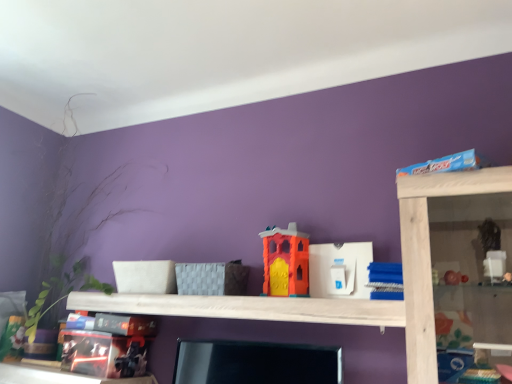
Question: Is white wood shelf at center taller than matt black toy at lower left, the fourth toy in the right-to-left sequence?

Choices:
 (A) no
 (B) yes

Answer: (A)

Question: Is white wood shelf at center in contact with matt black toy at lower left, the fourth toy in the right-to-left sequence?

Choices:
 (A) yes
 (B) no

Answer: (B)

Question: From the image's perspective, is white wood shelf at center on matt black toy at lower left, which is counted as the first toy, starting from the left?

Choices:
 (A) yes
 (B) no

Answer: (A)

Question: Is white wood shelf at center facing towards matt black toy at lower left, the fourth toy in the right-to-left sequence?

Choices:
 (A) yes
 (B) no

Answer: (B)

Question: Does white wood shelf at center have a lesser width compared to matt black toy at lower left, the fourth toy in the right-to-left sequence?

Choices:
 (A) no
 (B) yes

Answer: (B)

Question: Is point (217, 304) closer or farther from the camera than point (366, 269)?

Choices:
 (A) farther
 (B) closer

Answer: (A)

Question: Considering the positions of white wood shelf at center and white plastic toy at center, marked as the 2th toy in a right-to-left arrangement, in the image, is white wood shelf at center taller or shorter than white plastic toy at center, marked as the 2th toy in a right-to-left arrangement,?

Choices:
 (A) tall
 (B) short

Answer: (B)

Question: From the image's perspective, is white wood shelf at center positioned above or below white plastic toy at center, marked as the 2th toy in a right-to-left arrangement?

Choices:
 (A) above
 (B) below

Answer: (B)

Question: In terms of width, does white wood shelf at center look wider or thinner when compared to white plastic toy at center, marked as the 2th toy in a right-to-left arrangement?

Choices:
 (A) wide
 (B) thin

Answer: (A)

Question: In the image, is orange matte plastic toy at center, acting as the third toy starting from the right, on the left side or the right side of white wood shelf at center?

Choices:
 (A) right
 (B) left

Answer: (A)

Question: From a real-world perspective, is orange matte plastic toy at center, marked as the 2th toy in a left-to-right arrangement, physically located above or below white wood shelf at center?

Choices:
 (A) below
 (B) above

Answer: (B)

Question: Is point (305, 243) closer or farther from the camera than point (155, 294)?

Choices:
 (A) farther
 (B) closer

Answer: (B)

Question: Is orange matte plastic toy at center, marked as the 2th toy in a left-to-right arrangement, situated inside white wood shelf at center or outside?

Choices:
 (A) outside
 (B) inside

Answer: (A)

Question: Based on their sizes in the image, would you say white wood shelf at center is bigger or smaller than green leafy plant at left?

Choices:
 (A) small
 (B) big

Answer: (A)

Question: Considering their positions, is white wood shelf at center located in front of or behind green leafy plant at left?

Choices:
 (A) front
 (B) behind

Answer: (A)